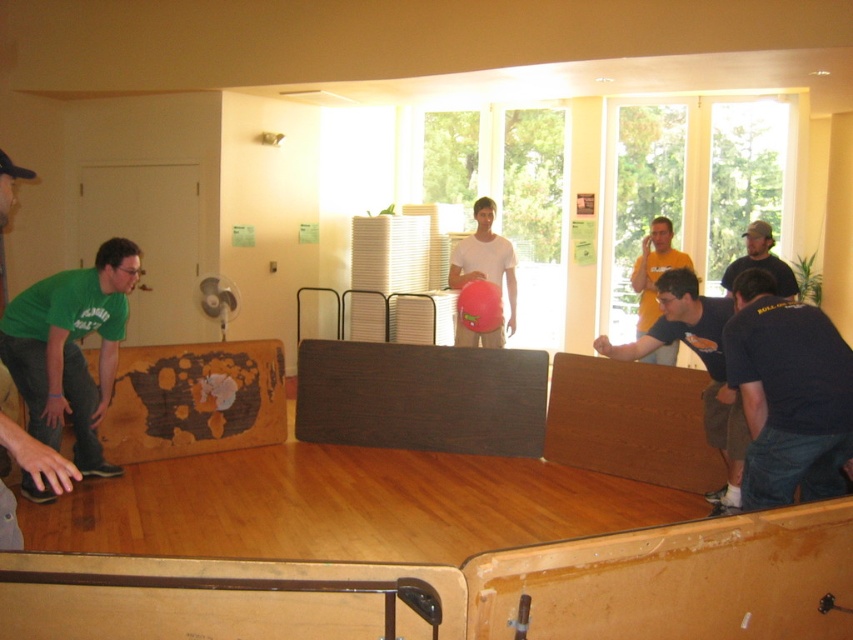
You are organizing a skateboarding event and need to ensure participants are wearing the correct size shirts. You notice two shirts available for distribution. The green matte shirt at lower left and the white matte shirt at center. Which shirt should a participant choose if they need a larger size?

The green matte shirt at lower left has a larger size compared to the white matte shirt at center, so the participant should choose the green matte shirt at lower left.